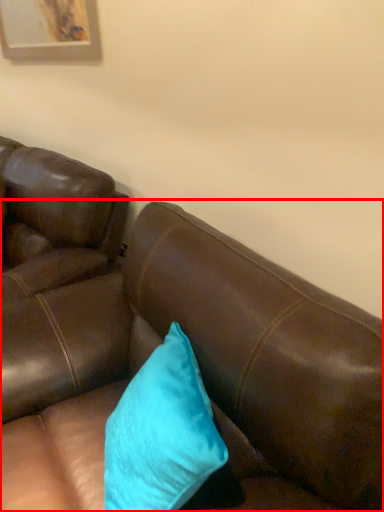
Question: From the image's perspective, what is the correct spatial relationship of studio couch (annotated by the red box) in relation to pillow?

Choices:
 (A) below
 (B) above

Answer: (A)